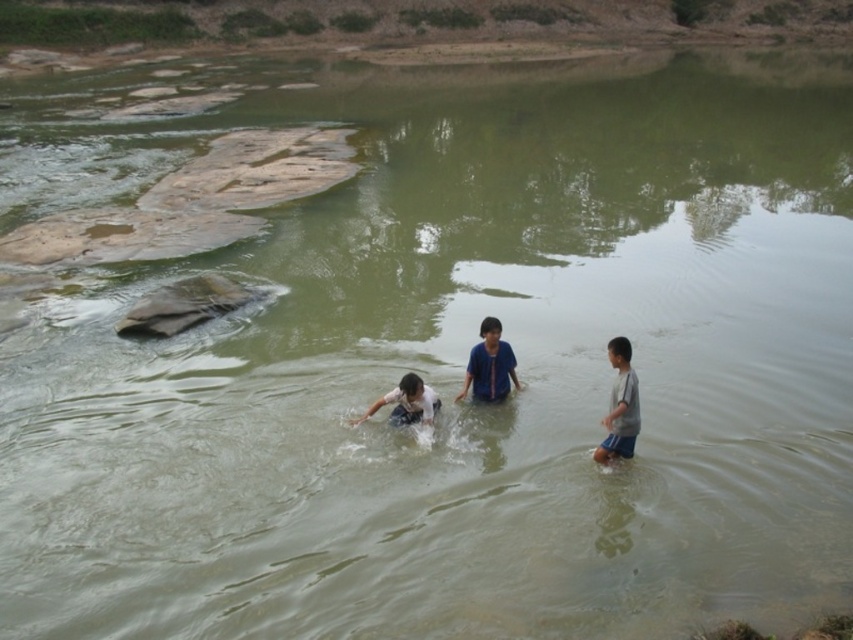
Question: Which object is farther from the camera taking this photo?

Choices:
 (A) gray cotton shorts at lower right
 (B) blue cotton shirt at center
 (C) gray rough rock at center-left
 (D) light blue fabric shirt at center

Answer: (C)

Question: Which is farther from the gray rough rock at center-left?

Choices:
 (A) blue cotton shirt at center
 (B) gray cotton shorts at lower right

Answer: (B)

Question: Which object is positioned closest to the light blue fabric shirt at center?

Choices:
 (A) gray rough rock at center-left
 (B) gray cotton shorts at lower right
 (C) blue cotton shirt at center

Answer: (C)

Question: Is blue cotton shirt at center to the left of light blue fabric shirt at center from the viewer's perspective?

Choices:
 (A) yes
 (B) no

Answer: (B)

Question: Does gray rough rock at center-left appear on the left side of blue cotton shirt at center?

Choices:
 (A) yes
 (B) no

Answer: (A)

Question: Is gray rough rock at center-left below light blue fabric shirt at center?

Choices:
 (A) yes
 (B) no

Answer: (B)